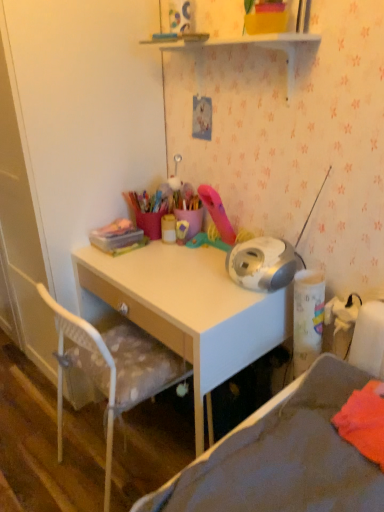
Question: From a real-world perspective, is white glossy shelf at upper center located higher than gray fabric bed at lower right?

Choices:
 (A) no
 (B) yes

Answer: (B)

Question: Can you confirm if white glossy shelf at upper center is thinner than gray fabric bed at lower right?

Choices:
 (A) yes
 (B) no

Answer: (A)

Question: From a real-world perspective, is white glossy shelf at upper center physically below gray fabric bed at lower right?

Choices:
 (A) no
 (B) yes

Answer: (A)

Question: Are white glossy shelf at upper center and gray fabric bed at lower right located far from each other?

Choices:
 (A) no
 (B) yes

Answer: (A)

Question: Can you confirm if white glossy shelf at upper center is shorter than gray fabric bed at lower right?

Choices:
 (A) yes
 (B) no

Answer: (B)

Question: Considering the positions of white mesh chair at lower left and white glossy shelf at upper center in the image, is white mesh chair at lower left taller or shorter than white glossy shelf at upper center?

Choices:
 (A) short
 (B) tall

Answer: (A)

Question: Is white mesh chair at lower left bigger or smaller than white glossy shelf at upper center?

Choices:
 (A) big
 (B) small

Answer: (A)

Question: From the image's perspective, is white mesh chair at lower left above or below white glossy shelf at upper center?

Choices:
 (A) above
 (B) below

Answer: (B)

Question: From a real-world perspective, relative to white glossy shelf at upper center, is white mesh chair at lower left vertically above or below?

Choices:
 (A) below
 (B) above

Answer: (A)

Question: Is white glossy shelf at upper center inside or outside of white mesh chair at lower left?

Choices:
 (A) inside
 (B) outside

Answer: (B)

Question: Considering their positions, is white glossy shelf at upper center located in front of or behind white mesh chair at lower left?

Choices:
 (A) front
 (B) behind

Answer: (A)

Question: In the image, is white glossy shelf at upper center on the left side or the right side of white mesh chair at lower left?

Choices:
 (A) right
 (B) left

Answer: (A)

Question: Is point (319, 38) positioned closer to the camera than point (129, 364)?

Choices:
 (A) farther
 (B) closer

Answer: (B)

Question: Is point (44, 301) closer or farther from the camera than point (119, 248)?

Choices:
 (A) farther
 (B) closer

Answer: (B)

Question: From a real-world perspective, is white mesh chair at lower left physically located above or below translucent plastic container at upper left, which appears as the 2th stationery when viewed from the right?

Choices:
 (A) above
 (B) below

Answer: (B)